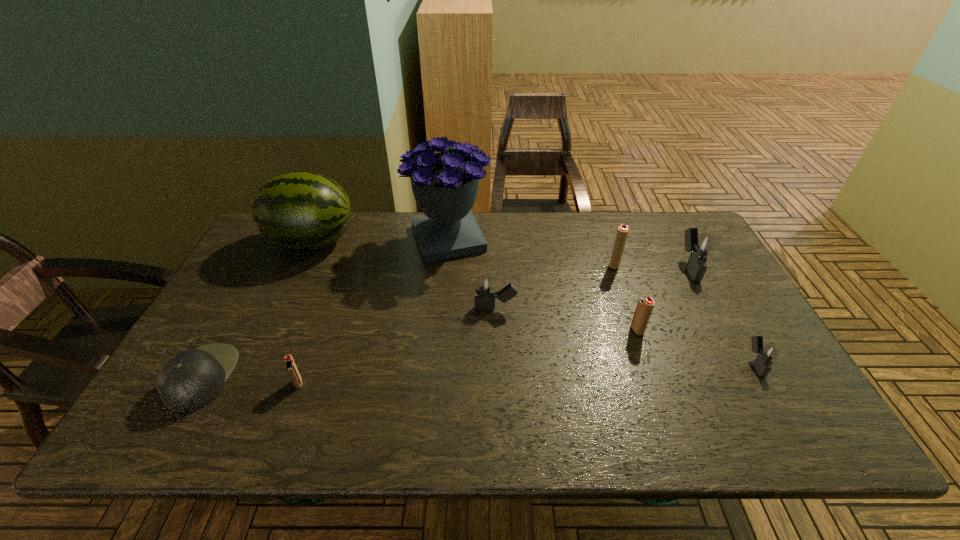
Locate an element on the screen. This screenshot has width=960, height=540. vacant point located between the farthest red igniter and the cap is located at coordinates (408, 321).

The image size is (960, 540). What are the coordinates of `empty space that is in between the cap and the fourth nearest object` in the screenshot? It's located at (420, 354).

At what (x,y) coordinates should I click in order to perform the action: click on vacant space that is in between the nearest red igniter and the biggest gray igniter. Please return your answer as a coordinate pair (x, y). This screenshot has width=960, height=540. Looking at the image, I should click on (493, 325).

Where is `vacant area that lies between the nearest gray igniter and the cap`? vacant area that lies between the nearest gray igniter and the cap is located at coordinates (478, 370).

Locate an element on the screen. free space between the smallest red igniter and the farthest red igniter is located at coordinates (456, 324).

You are a GUI agent. You are given a task and a screenshot of the screen. Output one action in this format:
    pyautogui.click(x=<x>, y=<y>)
    Task: Click on the free space between the second farthest gray igniter and the smallest gray igniter
    
    Given the screenshot: What is the action you would take?
    pyautogui.click(x=625, y=336)

Locate an element on the screen. Image resolution: width=960 pixels, height=540 pixels. vacant region between the nearest gray igniter and the farthest red igniter is located at coordinates (684, 314).

Where is `object that is the fifth closest to the smallest red igniter`? object that is the fifth closest to the smallest red igniter is located at coordinates (645, 305).

Locate which object ranks in proximity to the biggest gray igniter. Please provide its 2D coordinates. Your answer should be formatted as a tuple, i.e. [(x, y)], where the tuple contains the x and y coordinates of a point satisfying the conditions above.

[(622, 232)]

Choose which igniter is the second nearest neighbor to the second nearest gray igniter. Please provide its 2D coordinates. Your answer should be formatted as a tuple, i.e. [(x, y)], where the tuple contains the x and y coordinates of a point satisfying the conditions above.

[(622, 232)]